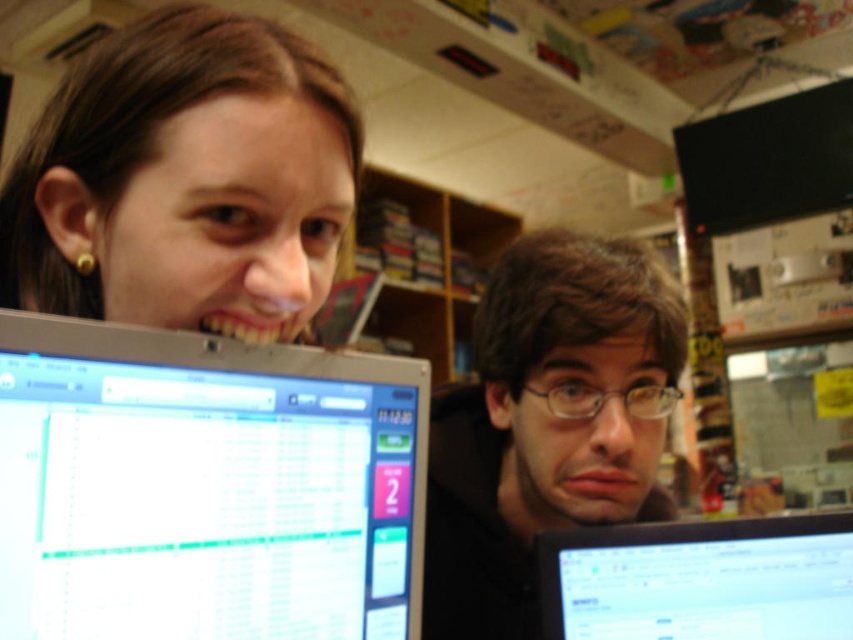
Can you confirm if matte black face at upper left is wider than black glossy monitor at lower right?

In fact, matte black face at upper left might be narrower than black glossy monitor at lower right.

Does matte black face at upper left appear over black glossy monitor at lower right?

Indeed, matte black face at upper left is positioned over black glossy monitor at lower right.

Between point (286, 177) and point (697, 618), which one is positioned behind?

Positioned behind is point (697, 618).

Image resolution: width=853 pixels, height=640 pixels. I want to click on matte black face at upper left, so click(x=184, y=179).

Is silver metallic monitor at left taller than matte black glasses at center?

No.

Is the position of silver metallic monitor at left less distant than that of matte black glasses at center?

Yes, silver metallic monitor at left is closer to the viewer.

Locate an element on the screen. silver metallic monitor at left is located at coordinates (206, 486).

Is matte black glasses at center closer to the viewer compared to black glossy monitor at lower right?

Yes, it is.

Is point (434, 422) positioned in front of point (566, 577)?

No, it is not.

Does point (434, 428) come closer to viewer compared to point (647, 540)?

No, it is not.

The width and height of the screenshot is (853, 640). Find the location of `matte black glasses at center`. matte black glasses at center is located at coordinates (547, 422).